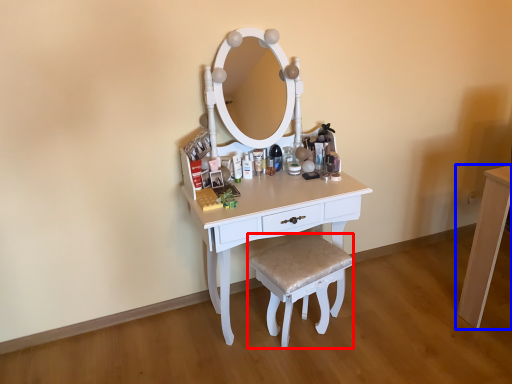
Question: Which object appears closest to the camera in this image, stool (highlighted by a red box) or table (highlighted by a blue box)?

Choices:
 (A) stool
 (B) table

Answer: (A)